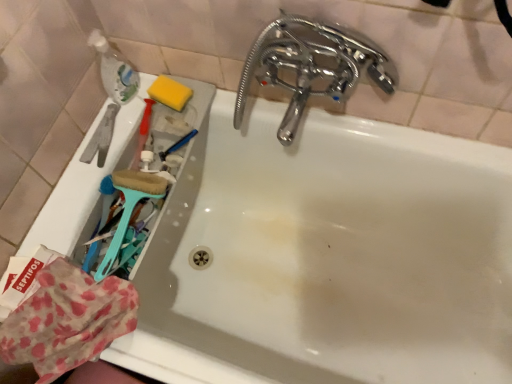
Where is `vacant space positioned to the left of teal plastic brush at left`? The height and width of the screenshot is (384, 512). vacant space positioned to the left of teal plastic brush at left is located at coordinates (81, 227).